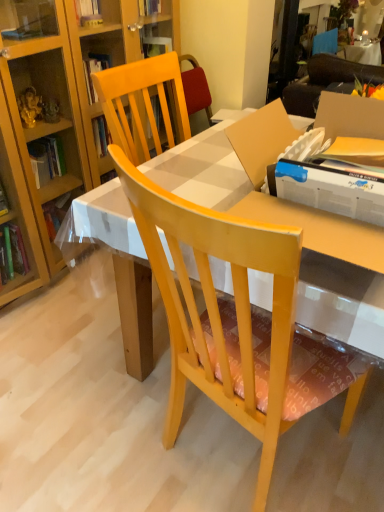
Question: Considering the relative sizes of brown fabric couch at upper right and green leafy plant at upper right in the image provided, is brown fabric couch at upper right bigger than green leafy plant at upper right?

Choices:
 (A) no
 (B) yes

Answer: (A)

Question: Is brown fabric couch at upper right next to green leafy plant at upper right and touching it?

Choices:
 (A) no
 (B) yes

Answer: (A)

Question: Is brown fabric couch at upper right at the right side of green leafy plant at upper right?

Choices:
 (A) yes
 (B) no

Answer: (B)

Question: From the image's perspective, does brown fabric couch at upper right appear higher than green leafy plant at upper right?

Choices:
 (A) no
 (B) yes

Answer: (A)

Question: Is brown fabric couch at upper right surrounding green leafy plant at upper right?

Choices:
 (A) no
 (B) yes

Answer: (A)

Question: From the image's perspective, is green leafy plant at upper right positioned above or below brown fabric couch at upper right?

Choices:
 (A) above
 (B) below

Answer: (A)

Question: In the image, is green leafy plant at upper right positioned in front of or behind brown fabric couch at upper right?

Choices:
 (A) behind
 (B) front

Answer: (A)

Question: From a real-world perspective, relative to brown fabric couch at upper right, is green leafy plant at upper right vertically above or below?

Choices:
 (A) below
 (B) above

Answer: (A)

Question: Which is correct: green leafy plant at upper right is inside brown fabric couch at upper right, or outside of it?

Choices:
 (A) outside
 (B) inside

Answer: (A)

Question: In the image, is brown fabric couch at upper right positioned in front of or behind green leafy plant at upper right?

Choices:
 (A) front
 (B) behind

Answer: (A)

Question: Is brown fabric couch at upper right wider or thinner than green leafy plant at upper right?

Choices:
 (A) thin
 (B) wide

Answer: (A)

Question: Is brown fabric couch at upper right inside the boundaries of green leafy plant at upper right, or outside?

Choices:
 (A) inside
 (B) outside

Answer: (B)

Question: Looking at the image, does brown fabric couch at upper right seem bigger or smaller compared to green leafy plant at upper right?

Choices:
 (A) big
 (B) small

Answer: (B)

Question: From their relative heights in the image, would you say light wood chair at center is taller or shorter than brown fabric couch at upper right?

Choices:
 (A) short
 (B) tall

Answer: (B)

Question: Is light wood chair at center spatially inside brown fabric couch at upper right, or outside of it?

Choices:
 (A) inside
 (B) outside

Answer: (B)